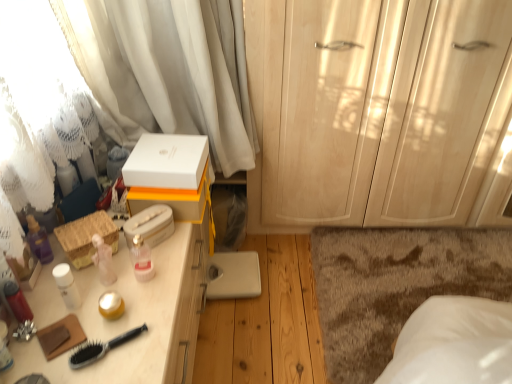
Question: Is white matte box at center, the first storage box from the top, looking in the opposite direction of matte white desk at left?

Choices:
 (A) yes
 (B) no

Answer: (B)

Question: From the image's perspective, does white matte box at center, the first storage box from the top, appear lower than matte white desk at left?

Choices:
 (A) yes
 (B) no

Answer: (B)

Question: Can you confirm if white matte box at center, which appears as the third storage box when ordered from the bottom, is positioned to the right of matte white desk at left?

Choices:
 (A) no
 (B) yes

Answer: (B)

Question: Does white matte box at center, which appears as the third storage box when ordered from the bottom, appear on the left side of matte white desk at left?

Choices:
 (A) no
 (B) yes

Answer: (A)

Question: From the image's perspective, is white matte box at center, which appears as the third storage box when ordered from the bottom, over matte white desk at left?

Choices:
 (A) no
 (B) yes

Answer: (B)

Question: Is white matte box at center, which appears as the third storage box when ordered from the bottom, closer to camera compared to matte white desk at left?

Choices:
 (A) no
 (B) yes

Answer: (A)

Question: Does black plastic brush at lower left contain brown shaggy rug at lower right?

Choices:
 (A) no
 (B) yes

Answer: (A)

Question: Considering the relative sizes of black plastic brush at lower left and brown shaggy rug at lower right in the image provided, is black plastic brush at lower left bigger than brown shaggy rug at lower right?

Choices:
 (A) yes
 (B) no

Answer: (B)

Question: Considering the relative sizes of black plastic brush at lower left and brown shaggy rug at lower right in the image provided, is black plastic brush at lower left wider than brown shaggy rug at lower right?

Choices:
 (A) yes
 (B) no

Answer: (B)

Question: Does black plastic brush at lower left lie behind brown shaggy rug at lower right?

Choices:
 (A) yes
 (B) no

Answer: (B)

Question: Can you confirm if black plastic brush at lower left is shorter than brown shaggy rug at lower right?

Choices:
 (A) yes
 (B) no

Answer: (A)

Question: Does black plastic brush at lower left lie in front of brown shaggy rug at lower right?

Choices:
 (A) no
 (B) yes

Answer: (B)

Question: Can you confirm if white matte box at center, which appears as the third storage box when ordered from the bottom, is positioned to the right of brown shaggy rug at lower right?

Choices:
 (A) yes
 (B) no

Answer: (B)